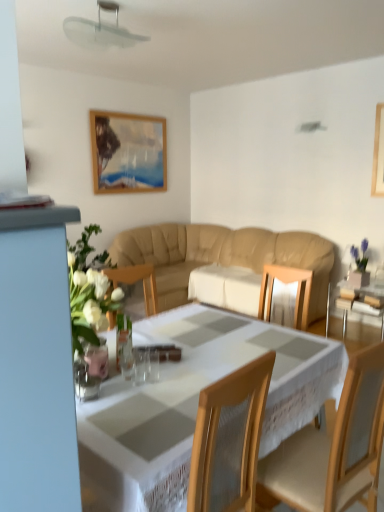
What are the coordinates of `beige leather couch at center` in the screenshot? It's located at (222, 256).

Describe the element at coordinates (333, 448) in the screenshot. The width and height of the screenshot is (384, 512). I see `wooden chair at center` at that location.

Measure the distance between point (354, 293) and camera.

Point (354, 293) is 4.09 meters from camera.

Identify the location of clear glass vase at lower left. This screenshot has height=512, width=384. (90, 370).

From the image's perspective, is clear glass vase at lower left beneath beige leather couch at center?

Indeed, from the image's perspective, clear glass vase at lower left is shown beneath beige leather couch at center.

Is clear glass vase at lower left beside beige leather couch at center?

clear glass vase at lower left is not next to beige leather couch at center, and they're not touching.

Could you tell me if transparent plastic fan at upper center is facing clear glass vase at lower left?

No, transparent plastic fan at upper center is not facing towards clear glass vase at lower left.

Is transparent plastic fan at upper center inside or outside of clear glass vase at lower left?

transparent plastic fan at upper center lies outside clear glass vase at lower left.

Are transparent plastic fan at upper center and clear glass vase at lower left far apart?

transparent plastic fan at upper center is positioned a significant distance from clear glass vase at lower left.

Find the location of a particular element. This screenshot has width=384, height=512. fan located behind the clear glass vase at lower left is located at coordinates (100, 30).

Which of these two, clear glass vase at lower left or white lace tablecloth at center, is thinner?

clear glass vase at lower left is thinner.

Considering the sizes of clear glass vase at lower left and white lace tablecloth at center in the image, is clear glass vase at lower left taller or shorter than white lace tablecloth at center?

Clearly, clear glass vase at lower left is shorter compared to white lace tablecloth at center.

Image resolution: width=384 pixels, height=512 pixels. Find the location of `table that is below the clear glass vase at lower left (from the image's perspective)`. table that is below the clear glass vase at lower left (from the image's perspective) is located at coordinates (193, 403).

Is clear glass vase at lower left next to white lace tablecloth at center?

clear glass vase at lower left and white lace tablecloth at center are clearly separated.

Is clear glass vase at lower left positioned far away from wooden chair at center?

No.

Relative to wooden chair at center, is clear glass vase at lower left in front or behind?

Visually, clear glass vase at lower left is located behind wooden chair at center.

From the image's perspective, is clear glass vase at lower left located above or below wooden chair at center?

clear glass vase at lower left is above wooden chair at center.

Between clear glass vase at lower left and transparent plastic fan at upper center, which one appears on the right side from the viewer's perspective?

clear glass vase at lower left.

Identify the location of glass vase on the right of transparent plastic fan at upper center. The height and width of the screenshot is (512, 384). (90, 370).

Is clear glass vase at lower left wider or thinner than transparent plastic fan at upper center?

clear glass vase at lower left is thinner than transparent plastic fan at upper center.

Is the surface of clear glass vase at lower left in direct contact with transparent plastic fan at upper center?

No, clear glass vase at lower left is not beside transparent plastic fan at upper center.

In the scene shown: Does white lace tablecloth at center have a smaller size compared to transparent glass table at right?

Actually, white lace tablecloth at center might be larger than transparent glass table at right.

Is white lace tablecloth at center wider or thinner than transparent glass table at right?

Clearly, white lace tablecloth at center has more width compared to transparent glass table at right.

Considering their positions, is white lace tablecloth at center located in front of or behind transparent glass table at right?

In the image, white lace tablecloth at center appears in front of transparent glass table at right.

Considering the relative positions of white lace tablecloth at center and transparent glass table at right in the image provided, is white lace tablecloth at center to the right of transparent glass table at right from the viewer's perspective?

No, white lace tablecloth at center is not to the right of transparent glass table at right.

You are a GUI agent. You are given a task and a screenshot of the screen. Output one action in this format:
    pyautogui.click(x=<x>, y=<y>)
    Task: Click on the studio couch behind the white lace tablecloth at center
    This screenshot has height=512, width=384.
    Given the screenshot: What is the action you would take?
    pyautogui.click(x=222, y=256)

How many degrees apart are the facing directions of beige leather couch at center and white lace tablecloth at center?

The facing directions of beige leather couch at center and white lace tablecloth at center are 177 degrees apart.

Is beige leather couch at center at the right side of white lace tablecloth at center?

Yes.

Which is further, [320,237] or [180,471]?

Answer: Point [320,237]

Locate an element on the screen. studio couch on the right of clear glass vase at lower left is located at coordinates (222, 256).

What are the coordinates of `fan on the left side of clear glass vase at lower left` in the screenshot? It's located at (100, 30).

From the picture: When comparing their distances from white lace tablecloth at center, does beige leather couch at center or transparent glass table at right seem further?

Based on the image, beige leather couch at center appears to be further to white lace tablecloth at center.

When comparing their distances from beige leather couch at center, does white lace tablecloth at center or transparent glass table at right seem further?

Among the two, white lace tablecloth at center is located further to beige leather couch at center.

Looking at the image, which one is located closer to wooden chair at center, transparent plastic fan at upper center or transparent glass table at right?

transparent glass table at right is positioned closer to the anchor wooden chair at center.

Considering their positions, is transparent glass table at right positioned further to beige leather couch at center than wooden chair at center?

Based on the image, wooden chair at center appears to be further to beige leather couch at center.

Estimate the real-world distances between objects in this image. Which object is closer to transparent glass table at right, white lace tablecloth at center or transparent plastic fan at upper center?

white lace tablecloth at center is closer to transparent glass table at right.

Looking at the image, which one is located further to wooden chair at center, beige leather couch at center or transparent plastic fan at upper center?

beige leather couch at center.

Estimate the real-world distances between objects in this image. Which object is further from clear glass vase at lower left, transparent plastic fan at upper center or white lace tablecloth at center?

transparent plastic fan at upper center lies further to clear glass vase at lower left than the other object.

In the scene shown: Estimate the real-world distances between objects in this image. Which object is further from beige leather couch at center, transparent glass table at right or clear glass vase at lower left?

Among the two, clear glass vase at lower left is located further to beige leather couch at center.

At what (x,y) coordinates should I click in order to perform the action: click on studio couch between wooden chair at center and transparent glass table at right from front to back. Please return your answer as a coordinate pair (x, y). The image size is (384, 512). Looking at the image, I should click on (222, 256).

What are the coordinates of `studio couch between clear glass vase at lower left and transparent glass table at right along the z-axis` in the screenshot? It's located at (222, 256).

Identify the location of glass table between transparent plastic fan at upper center and wooden chair at center vertically. The image size is (384, 512). (361, 303).

Locate an element on the screen. The width and height of the screenshot is (384, 512). glass vase positioned between wooden chair at center and transparent glass table at right from near to far is located at coordinates (90, 370).